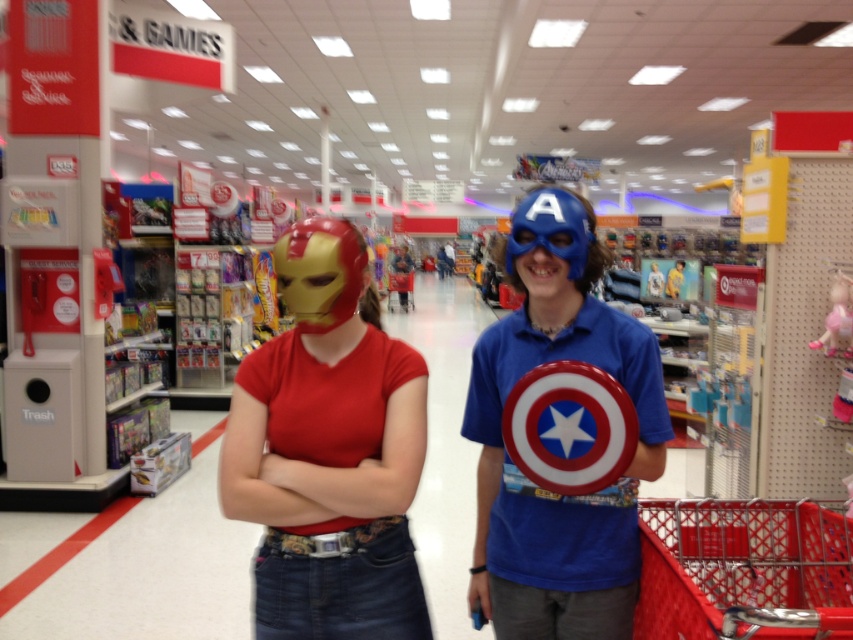
Who is positioned more to the right, shiny plastic shield at center or pink fabric doll at center right?

Positioned to the right is pink fabric doll at center right.

Can you confirm if shiny plastic shield at center is taller than pink fabric doll at center right?

Indeed, shiny plastic shield at center has a greater height compared to pink fabric doll at center right.

Is point (612, 547) closer to camera compared to point (822, 333)?

Yes, it is.

In order to click on shiny plastic shield at center in this screenshot , I will do `click(560, 544)`.

Is shiny metallic mask at center positioned before pink fabric doll at center right?

That is True.

This screenshot has width=853, height=640. What do you see at coordinates (560, 499) in the screenshot? I see `shiny metallic mask at center` at bounding box center [560, 499].

The image size is (853, 640). I want to click on shiny metallic mask at center, so click(x=560, y=499).

You are a GUI agent. You are given a task and a screenshot of the screen. Output one action in this format:
    pyautogui.click(x=<x>, y=<y>)
    Task: Click on the matte gold mask at center
    The width and height of the screenshot is (853, 640).
    Given the screenshot: What is the action you would take?
    pyautogui.click(x=328, y=452)

Where is `matte gold mask at center`? This screenshot has width=853, height=640. matte gold mask at center is located at coordinates (328, 452).